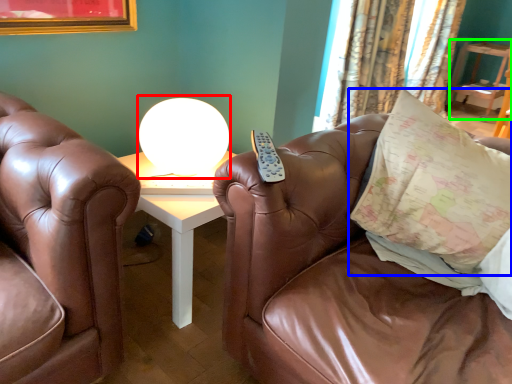
Question: Which object is positioned closest to table lamp (highlighted by a red box)? Select from pillow (highlighted by a blue box) and table (highlighted by a green box).

Choices:
 (A) pillow
 (B) table

Answer: (A)